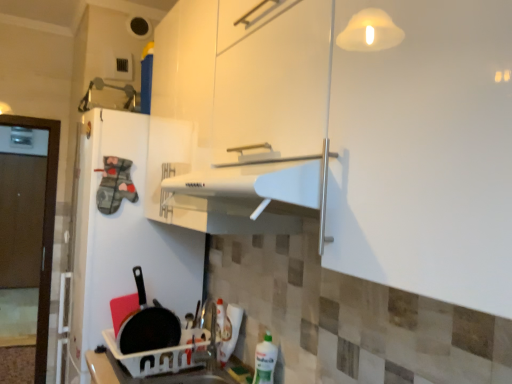
Question: Is green plastic bottle at lower right aimed at black matte frying pan at lower left?

Choices:
 (A) yes
 (B) no

Answer: (B)

Question: From the image's perspective, is green plastic bottle at lower right over black matte frying pan at lower left?

Choices:
 (A) yes
 (B) no

Answer: (B)

Question: Considering the relative sizes of green plastic bottle at lower right and black matte frying pan at lower left in the image provided, is green plastic bottle at lower right wider than black matte frying pan at lower left?

Choices:
 (A) no
 (B) yes

Answer: (B)

Question: From the image's perspective, would you say green plastic bottle at lower right is shown under black matte frying pan at lower left?

Choices:
 (A) no
 (B) yes

Answer: (B)

Question: From a real-world perspective, is green plastic bottle at lower right physically above black matte frying pan at lower left?

Choices:
 (A) no
 (B) yes

Answer: (A)

Question: From their relative heights in the image, would you say white matte refrigerator at left is taller or shorter than white plastic sink at lower center?

Choices:
 (A) short
 (B) tall

Answer: (B)

Question: Is point (75, 362) closer or farther from the camera than point (209, 375)?

Choices:
 (A) closer
 (B) farther

Answer: (B)

Question: Visually, is white matte refrigerator at left positioned to the left or to the right of white plastic sink at lower center?

Choices:
 (A) right
 (B) left

Answer: (B)

Question: In the image, is white matte refrigerator at left positioned in front of or behind white plastic sink at lower center?

Choices:
 (A) behind
 (B) front

Answer: (A)

Question: Considering the positions of white plastic sink at lower center and white matte refrigerator at left in the image, is white plastic sink at lower center wider or thinner than white matte refrigerator at left?

Choices:
 (A) wide
 (B) thin

Answer: (B)

Question: In the image, is white plastic sink at lower center positioned in front of or behind white matte refrigerator at left?

Choices:
 (A) behind
 (B) front

Answer: (B)

Question: From a real-world perspective, is white plastic sink at lower center positioned above or below white matte refrigerator at left?

Choices:
 (A) above
 (B) below

Answer: (B)

Question: In terms of height, does white plastic sink at lower center look taller or shorter compared to white matte refrigerator at left?

Choices:
 (A) short
 (B) tall

Answer: (A)

Question: From a real-world perspective, is green plastic bottle at lower right above or below white plastic sink at lower center?

Choices:
 (A) above
 (B) below

Answer: (A)

Question: Visually, is green plastic bottle at lower right positioned to the left or to the right of white plastic sink at lower center?

Choices:
 (A) left
 (B) right

Answer: (B)